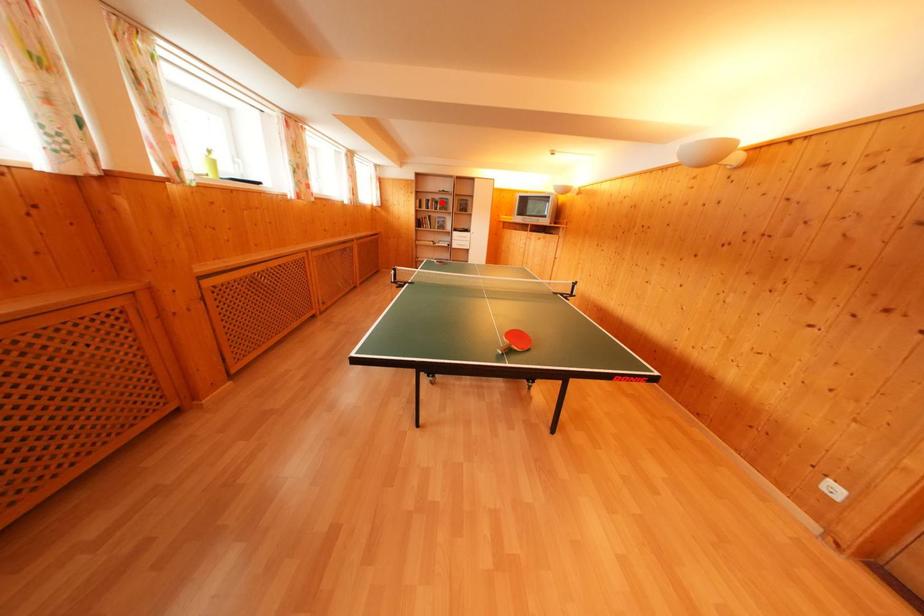
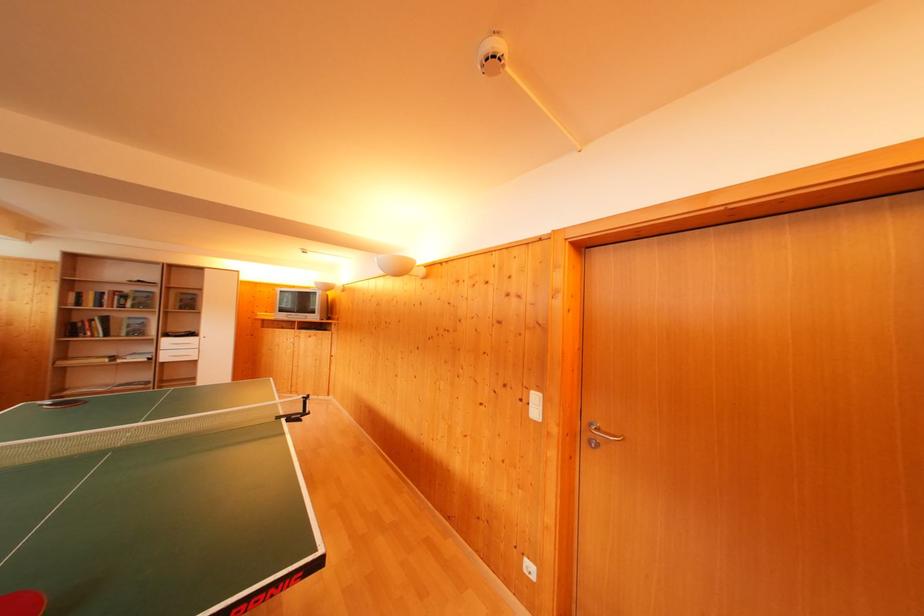
Question: I am providing you with two images of the same scene from different viewpoints. Given a red point in image1, look at the same physical point in image2. Is it:

Choices:
 (A) Closer to the viewpoint
 (B) Farther from the viewpoint

Answer: (B)